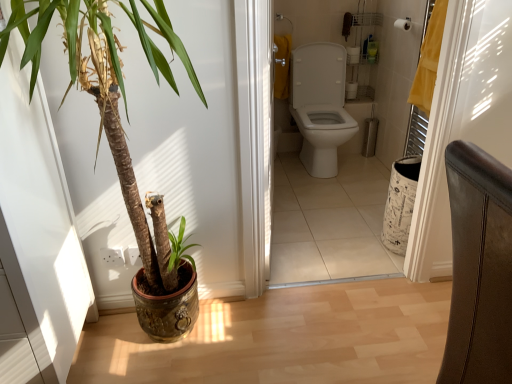
Describe the element at coordinates (109, 95) in the screenshot. The height and width of the screenshot is (384, 512). I see `green glossy plant at left` at that location.

What is the approximate width of white glossy toilet at center?

It is 5.39 inches.

Describe the element at coordinates (479, 268) in the screenshot. I see `leather-like chair at right` at that location.

At what (x,y) coordinates should I click in order to perform the action: click on green glossy plant at left. Please return your answer as a coordinate pair (x, y). The image size is (512, 384). Looking at the image, I should click on (109, 95).

Consider the image. Considering their positions, is white glossy toilet at center located in front of or behind white matte toilet paper at upper center?

Visually, white glossy toilet at center is located in front of white matte toilet paper at upper center.

Are white glossy toilet at center and white matte toilet paper at upper center far apart?

No, white glossy toilet at center is in close proximity to white matte toilet paper at upper center.

Is white glossy toilet at center situated inside white matte toilet paper at upper center or outside?

The correct answer is: outside.

Considering the sizes of objects white glossy toilet at center and white matte toilet paper at upper center in the image provided, who is taller, white glossy toilet at center or white matte toilet paper at upper center?

white glossy toilet at center.

From the image's perspective, does leather-like chair at right appear higher than white matte toilet paper at upper center?

No, from the image's perspective, leather-like chair at right is not over white matte toilet paper at upper center.

Are leather-like chair at right and white matte toilet paper at upper center beside each other?

leather-like chair at right and white matte toilet paper at upper center are clearly separated.

Can you confirm if leather-like chair at right is smaller than white matte toilet paper at upper center?

No, leather-like chair at right is not smaller than white matte toilet paper at upper center.

Is leather-like chair at right surrounding white matte toilet paper at upper center?

No, white matte toilet paper at upper center is not surrounded by leather-like chair at right.

Can you tell me how much green glossy plant at left and white matte toilet paper at upper center differ in facing direction?

The angle between the facing direction of green glossy plant at left and the facing direction of white matte toilet paper at upper center is 91.2 degrees.

From the image's perspective, between green glossy plant at left and white matte toilet paper at upper center, which one is located above?

white matte toilet paper at upper center.

Considering the sizes of green glossy plant at left and white matte toilet paper at upper center in the image, is green glossy plant at left bigger or smaller than white matte toilet paper at upper center?

Considering their sizes, green glossy plant at left takes up more space than white matte toilet paper at upper center.

This screenshot has width=512, height=384. Find the location of `houseplant below the white matte toilet paper at upper center (from the image's perspective)`. houseplant below the white matte toilet paper at upper center (from the image's perspective) is located at coordinates (109, 95).

Can you confirm if green glossy plant at left is thinner than leather-like chair at right?

In fact, green glossy plant at left might be wider than leather-like chair at right.

Is green glossy plant at left completely or partially outside of leather-like chair at right?

Yes, green glossy plant at left is outside of leather-like chair at right.

From a real-world perspective, is green glossy plant at left physically above leather-like chair at right?

Correct, in the physical world, green glossy plant at left is higher than leather-like chair at right.

Is white matte toilet paper at upper center looking in the opposite direction of white glossy toilet at center?

No, white matte toilet paper at upper center is not facing away from white glossy toilet at center.

You are a GUI agent. You are given a task and a screenshot of the screen. Output one action in this format:
    pyautogui.click(x=<x>, y=<y>)
    Task: Click on the corridor lying in front of the white matte toilet paper at upper center
    Image resolution: width=512 pixels, height=384 pixels.
    Given the screenshot: What is the action you would take?
    pyautogui.click(x=327, y=233)

In terms of height, does white matte toilet paper at upper center look taller or shorter compared to white glossy toilet at center?

Clearly, white matte toilet paper at upper center is shorter compared to white glossy toilet at center.

Considering the sizes of objects white matte toilet paper at upper center and white glossy toilet at center in the image provided, who is thinner, white matte toilet paper at upper center or white glossy toilet at center?

Thinner between the two is white matte toilet paper at upper center.

Which is correct: green glossy plant at left is inside white glossy toilet at center, or outside of it?

green glossy plant at left is located beyond the bounds of white glossy toilet at center.

I want to click on houseplant below the white glossy toilet at center (from the image's perspective), so [109, 95].

Is green glossy plant at left turned away from white glossy toilet at center?

No, green glossy plant at left is not facing away from white glossy toilet at center.

From the image's perspective, which one is positioned lower, green glossy plant at left or white glossy toilet at center?

green glossy plant at left.

From the image's perspective, is leather-like chair at right under green glossy plant at left?

Yes, from the image's perspective, leather-like chair at right is below green glossy plant at left.

Can you confirm if leather-like chair at right is bigger than green glossy plant at left?

Incorrect, leather-like chair at right is not larger than green glossy plant at left.

From a real-world perspective, which is physically above, leather-like chair at right or green glossy plant at left?

green glossy plant at left.

Find the location of a particular element. toilet paper above the white glossy toilet at center (from the image's perspective) is located at coordinates (403, 24).

The image size is (512, 384). Identify the location of toilet paper that appears above the leather-like chair at right (from a real-world perspective). (403, 24).

Estimate the real-world distances between objects in this image. Which object is closer to green glossy plant at left, white matte toilet paper at upper center or leather-like chair at right?

Among the two, leather-like chair at right is located nearer to green glossy plant at left.

Estimate the real-world distances between objects in this image. Which object is further from white matte toilet paper at upper center, green glossy plant at left or leather-like chair at right?

Among the two, leather-like chair at right is located further to white matte toilet paper at upper center.

Which object lies nearer to the anchor point green glossy plant at left, white glossy toilet at center or white matte toilet paper at upper center?

white glossy toilet at center.

Considering their positions, is green glossy plant at left positioned closer to white glossy toilet at center than leather-like chair at right?

green glossy plant at left is positioned closer to the anchor white glossy toilet at center.

Considering their positions, is white matte toilet paper at upper center positioned further to white glossy toilet at center than leather-like chair at right?

leather-like chair at right lies further to white glossy toilet at center than the other object.

Which object lies nearer to the anchor point leather-like chair at right, white glossy toilet at center or green glossy plant at left?

Based on the image, green glossy plant at left appears to be nearer to leather-like chair at right.

When comparing their distances from leather-like chair at right, does white matte toilet paper at upper center or green glossy plant at left seem closer?

Among the two, green glossy plant at left is located nearer to leather-like chair at right.

Considering their positions, is white matte toilet paper at upper center positioned further to green glossy plant at left than white glossy toilet at center?

white matte toilet paper at upper center is positioned further to the anchor green glossy plant at left.

At what (x,y) coordinates should I click in order to perform the action: click on corridor located between green glossy plant at left and leather-like chair at right in the left-right direction. Please return your answer as a coordinate pair (x, y). The width and height of the screenshot is (512, 384). Looking at the image, I should click on (327, 233).

Find the location of a particular element. Image resolution: width=512 pixels, height=384 pixels. houseplant between leather-like chair at right and white matte toilet paper at upper center along the z-axis is located at coordinates (109, 95).

What are the coordinates of `corridor positioned between green glossy plant at left and white matte toilet paper at upper center from near to far` in the screenshot? It's located at (327, 233).

Where is `corridor located between leather-like chair at right and white matte toilet paper at upper center in the depth direction`? Image resolution: width=512 pixels, height=384 pixels. corridor located between leather-like chair at right and white matte toilet paper at upper center in the depth direction is located at coordinates (327, 233).